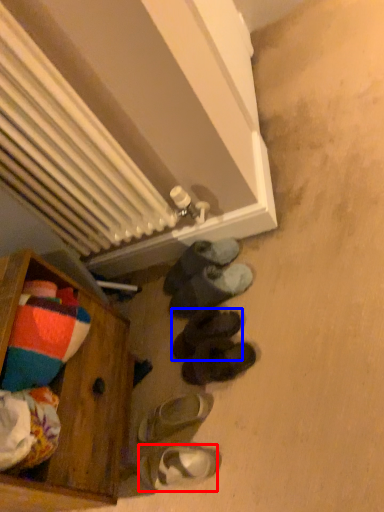
Question: Which of the following is the closest to the observer, footwear (highlighted by a red box) or footwear (highlighted by a blue box)?

Choices:
 (A) footwear
 (B) footwear

Answer: (A)